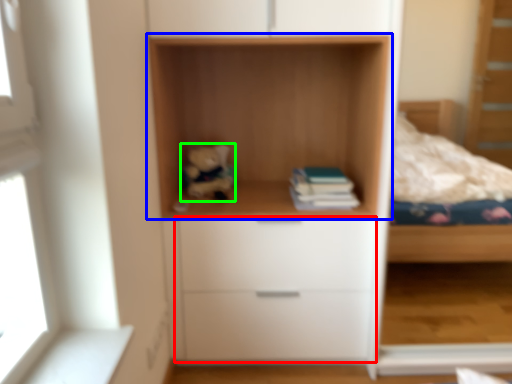
Question: Which object is positioned closest to drawer (highlighted by a red box)? Select from shelf (highlighted by a blue box) and toy (highlighted by a green box).

Choices:
 (A) shelf
 (B) toy

Answer: (A)